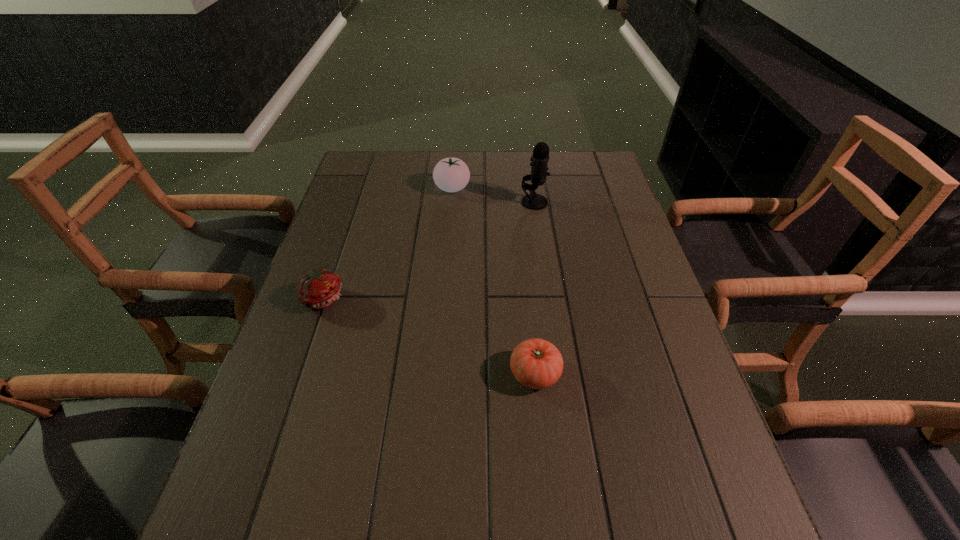
Where is `free space located 0.180m on the left of the rightmost tomato`? The height and width of the screenshot is (540, 960). free space located 0.180m on the left of the rightmost tomato is located at coordinates (425, 374).

You are a GUI agent. You are given a task and a screenshot of the screen. Output one action in this format:
    pyautogui.click(x=<x>, y=<y>)
    Task: Click on the object at the far edge
    
    Given the screenshot: What is the action you would take?
    pyautogui.click(x=450, y=174)

At what (x,y) coordinates should I click in order to perform the action: click on object that is positioned at the left edge. Please return your answer as a coordinate pair (x, y). The height and width of the screenshot is (540, 960). Looking at the image, I should click on (320, 288).

In the image, there is a desktop. Where is `vacant space at the far edge`? The width and height of the screenshot is (960, 540). vacant space at the far edge is located at coordinates (465, 160).

Image resolution: width=960 pixels, height=540 pixels. Find the location of `free region at the left edge of the desktop`. free region at the left edge of the desktop is located at coordinates (349, 194).

Where is `blank space at the right edge of the desktop`? This screenshot has width=960, height=540. blank space at the right edge of the desktop is located at coordinates (598, 193).

Locate an element on the screen. Image resolution: width=960 pixels, height=540 pixels. vacant region at the far left corner of the desktop is located at coordinates (355, 158).

You are a GUI agent. You are given a task and a screenshot of the screen. Output one action in this format:
    pyautogui.click(x=<x>, y=<y>)
    Task: Click on the free point at the far right corner
    The width and height of the screenshot is (960, 540).
    Given the screenshot: What is the action you would take?
    pyautogui.click(x=606, y=177)

Locate an element on the screen. This screenshot has height=540, width=960. vacant space that's between the rightmost tomato and the farthest tomato is located at coordinates coord(493,281).

The image size is (960, 540). I want to click on vacant area that lies between the tallest object and the leftmost tomato, so click(x=429, y=250).